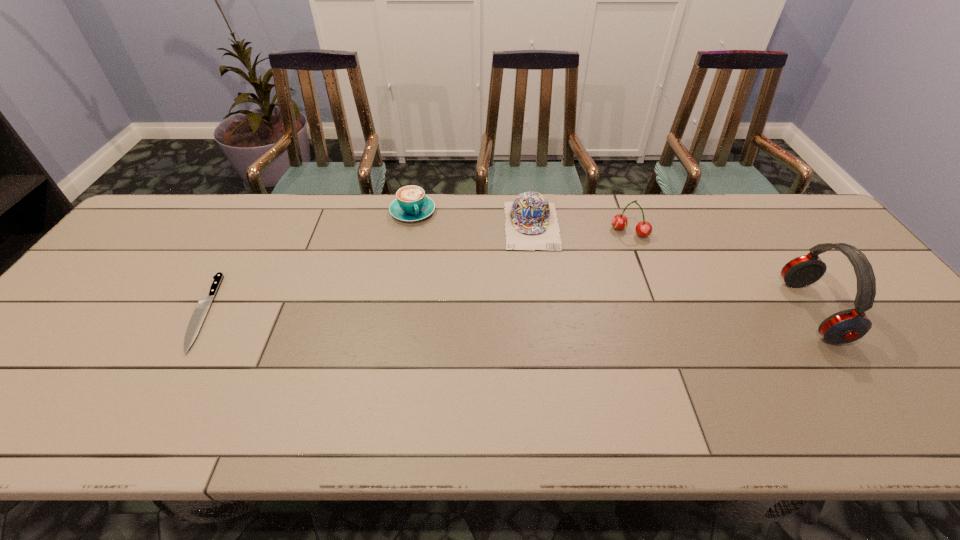
The image size is (960, 540). In order to click on free space that is in between the steak knife and the tallest object in this screenshot , I will do `click(508, 312)`.

Identify the location of vacant space that is in between the tallest object and the third object from left to right. The width and height of the screenshot is (960, 540). (672, 268).

At what (x,y) coordinates should I click in order to perform the action: click on vacant space that is in between the earphone and the fourth object from left to right. Please return your answer as a coordinate pair (x, y). This screenshot has width=960, height=540. Looking at the image, I should click on (721, 272).

Find the location of a particular element. The width and height of the screenshot is (960, 540). vacant space in between the earphone and the steak knife is located at coordinates (508, 312).

The image size is (960, 540). I want to click on vacant area that lies between the rightmost object and the cap, so click(672, 268).

At what (x,y) coordinates should I click in order to perform the action: click on vacant region between the cap and the cappuccino. Please return your answer as a coordinate pair (x, y). This screenshot has height=540, width=960. Looking at the image, I should click on (472, 219).

You are a GUI agent. You are given a task and a screenshot of the screen. Output one action in this format:
    pyautogui.click(x=<x>, y=<y>)
    Task: Click on the empty location between the cappuccino and the tallest object
    The image size is (960, 540).
    Given the screenshot: What is the action you would take?
    pyautogui.click(x=612, y=261)

Identify the location of object that stands as the fourth closest to the cap. The width and height of the screenshot is (960, 540). click(x=203, y=305).

Identify which object is the fourth nearest to the fourth object from left to right. Please provide its 2D coordinates. Your answer should be formatted as a tuple, i.e. [(x, y)], where the tuple contains the x and y coordinates of a point satisfying the conditions above.

[(203, 305)]

The width and height of the screenshot is (960, 540). I want to click on free spot that satisfies the following two spatial constraints: 1. on the front side of the rightmost object; 2. on the ear cups of the cap, so click(543, 311).